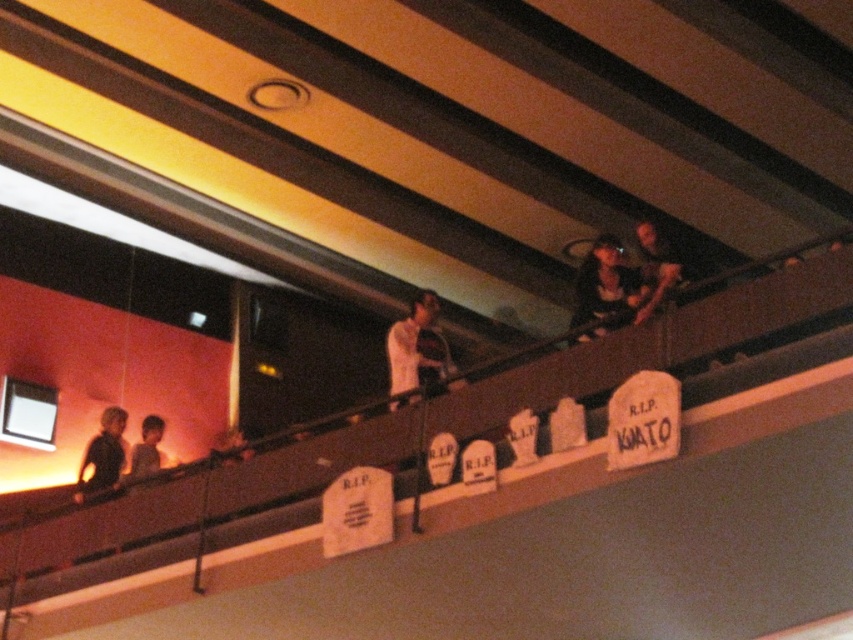
You are a photographer standing at point (654, 268). You want to capture a closeup of the smooth skin face at upper right. Is the point you are standing at the correct location to do so?

Yes, because the smooth skin face at upper right is located exactly at point (654, 268).

You are organizing a themed costume party and have two shirts available. You need to decide which one to wear based on size. The white matte shirt at center and the black matte shirt at left are both options. Which shirt has a larger size?

The white matte shirt at center is bigger than the black matte shirt at left, so the white matte shirt at center has a larger size.